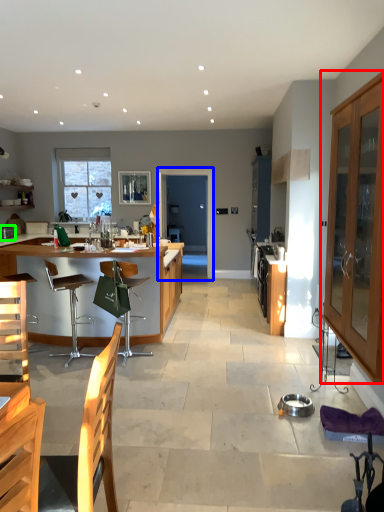
Question: Estimate the real-world distances between objects in this image. Which object is closer to cabinetry (highlighted by a red box), glass door (highlighted by a blue box) or appliance (highlighted by a green box)?

Choices:
 (A) glass door
 (B) appliance

Answer: (B)